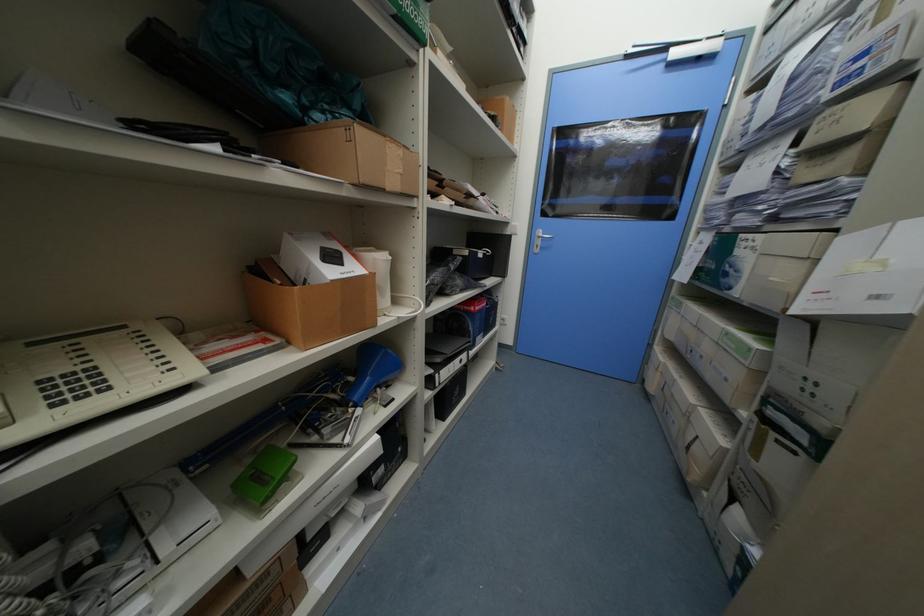
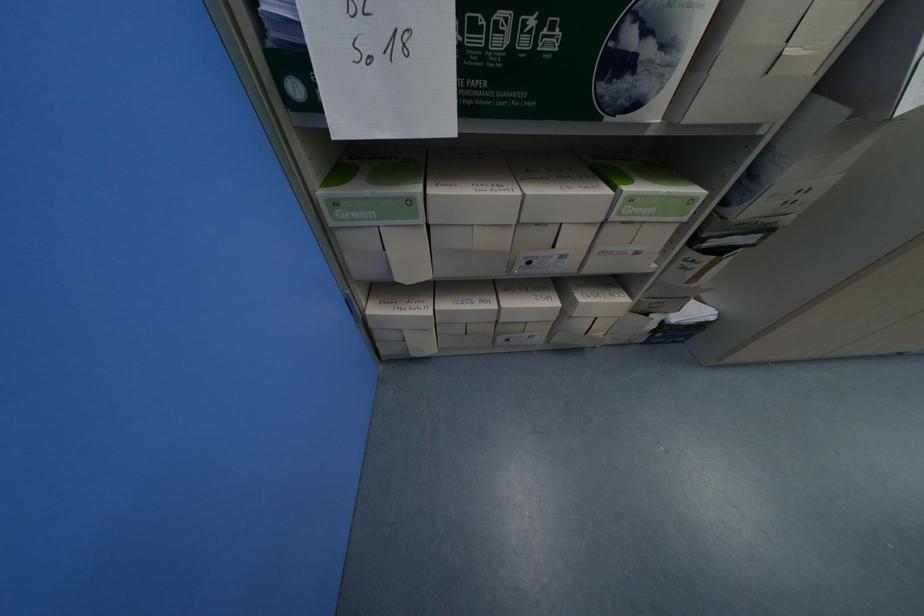
The point at (687, 305) is marked in the first image. Where is the corresponding point in the second image?

(417, 203)